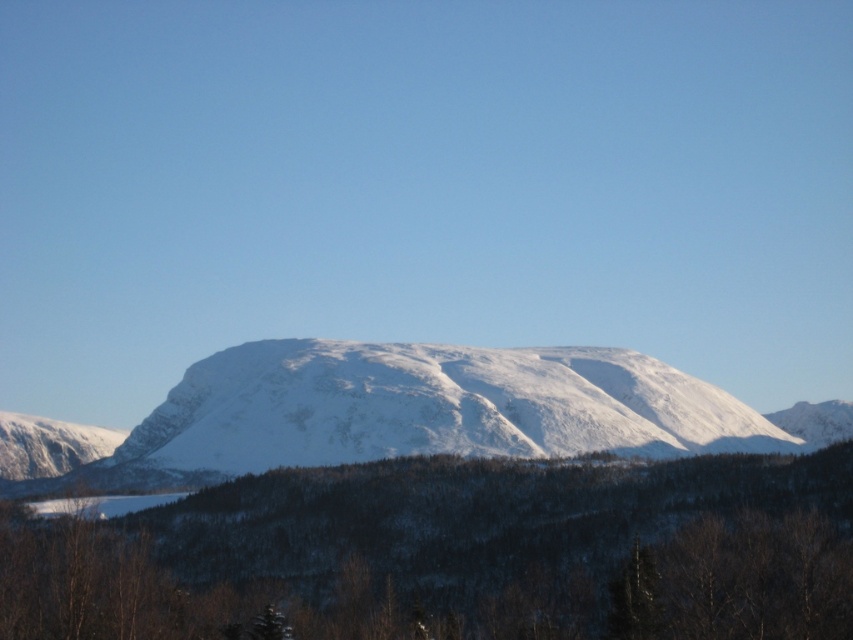
Is green matte tree at center above white snow-covered mountain at center?

Actually, green matte tree at center is below white snow-covered mountain at center.

Which of these two, green matte tree at center or white snow-covered mountain at center, stands shorter?

green matte tree at center is shorter.

Where is `green matte tree at center`? green matte tree at center is located at coordinates (456, 554).